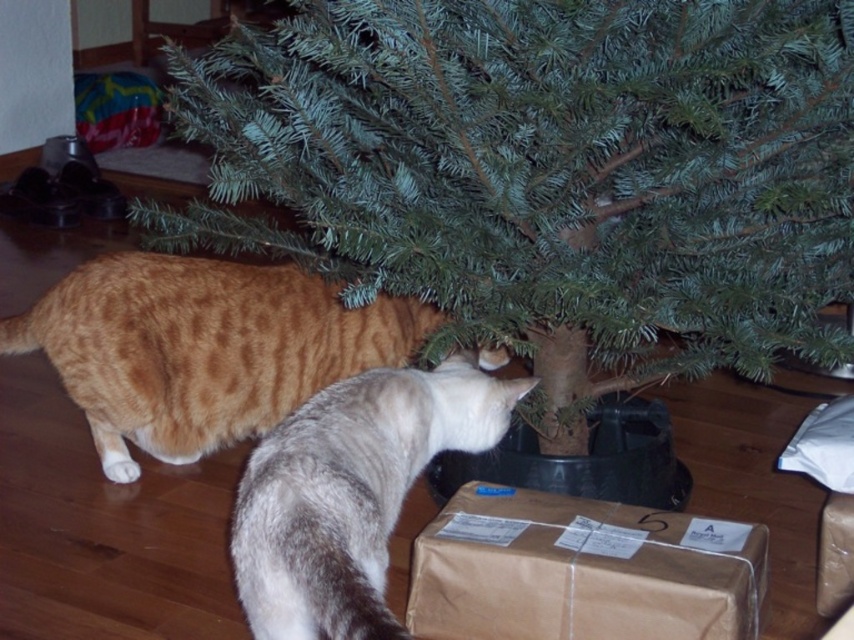
Can you confirm if green matte tree at center is smaller than gray fur cat at lower center?

No.

Between point (621, 232) and point (299, 609), which one is positioned in front?

Point (299, 609) is in front.

Find the location of a particular element. green matte tree at center is located at coordinates (547, 173).

Locate an element on the screen. Image resolution: width=854 pixels, height=640 pixels. green matte tree at center is located at coordinates (547, 173).

Consider the image. Can you confirm if green matte tree at center is thinner than orange tabby cat at lower left?

No, green matte tree at center is not thinner than orange tabby cat at lower left.

Does green matte tree at center appear over orange tabby cat at lower left?

Correct, green matte tree at center is located above orange tabby cat at lower left.

Does point (518, 3) come behind point (139, 433)?

No, it is in front of (139, 433).

Image resolution: width=854 pixels, height=640 pixels. I want to click on green matte tree at center, so click(x=547, y=173).

From the picture: Who is lower down, orange tabby cat at lower left or gray fur cat at lower center?

gray fur cat at lower center is lower down.

Is orange tabby cat at lower left smaller than gray fur cat at lower center?

No, orange tabby cat at lower left is not smaller than gray fur cat at lower center.

This screenshot has width=854, height=640. What do you see at coordinates (202, 348) in the screenshot? I see `orange tabby cat at lower left` at bounding box center [202, 348].

I want to click on orange tabby cat at lower left, so 202,348.